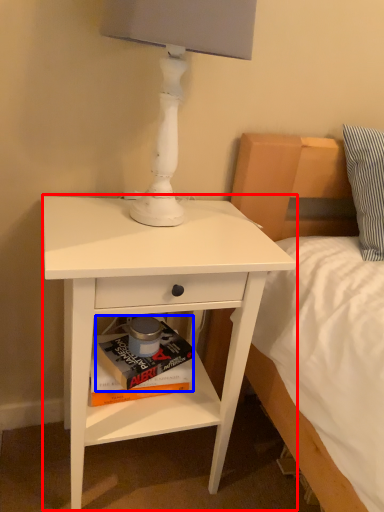
Question: Which object appears closest to the camera in this image, nightstand (highlighted by a red box) or paperback book (highlighted by a blue box)?

Choices:
 (A) nightstand
 (B) paperback book

Answer: (A)